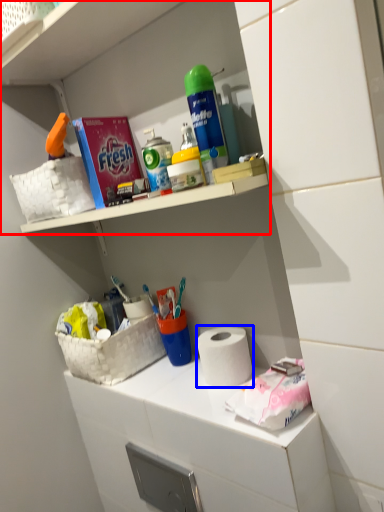
Question: Which point is closer to the camera, shelf (highlighted by a red box) or paper towel (highlighted by a blue box)?

Choices:
 (A) shelf
 (B) paper towel

Answer: (A)